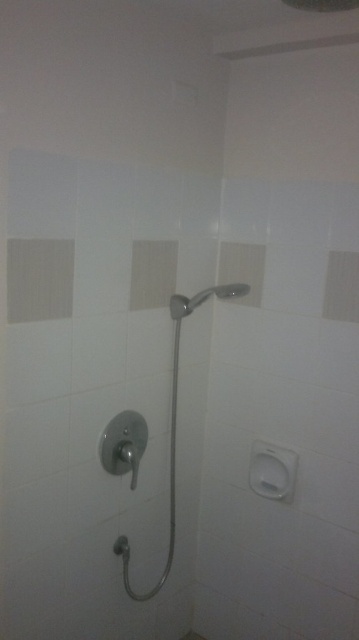
Question: Which point is closer to the camera taking this photo?

Choices:
 (A) (184, 312)
 (B) (170, 472)

Answer: (A)

Question: Which point appears closest to the camera in this image?

Choices:
 (A) (174, 396)
 (B) (174, 310)

Answer: (B)

Question: Does silver metallic shower head at center have a smaller size compared to satin nickel shower handle at center?

Choices:
 (A) yes
 (B) no

Answer: (B)

Question: Is silver metallic shower head at center closer to the viewer compared to satin nickel shower handle at center?

Choices:
 (A) no
 (B) yes

Answer: (B)

Question: Among these points, which one is nearest to the camera?

Choices:
 (A) (198, 305)
 (B) (226, 289)

Answer: (A)

Question: Is silver metallic shower head at center bigger than satin nickel shower handle at center?

Choices:
 (A) no
 (B) yes

Answer: (B)